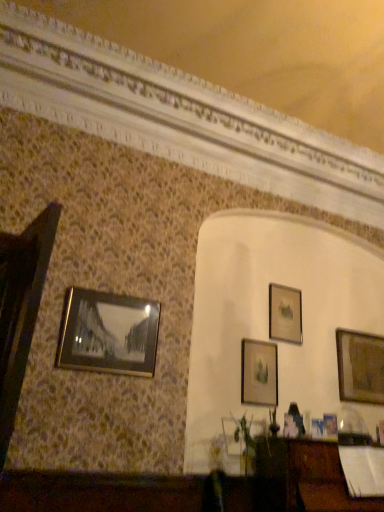
Question: From a real-world perspective, is matte gold picture frame at center, the third picture frame from the back, located beneath matte gold picture frame at upper right, which is the 4th picture frame from front to back?

Choices:
 (A) yes
 (B) no

Answer: (A)

Question: Is matte gold picture frame at center, arranged as the 3th picture frame when viewed from the front, facing away from matte gold picture frame at upper right, which is the 2th picture frame in back-to-front order?

Choices:
 (A) no
 (B) yes

Answer: (A)

Question: Can matte gold picture frame at upper right, which ranks as the third picture frame in left-to-right order, be found inside matte gold picture frame at center, the third picture frame from the back?

Choices:
 (A) no
 (B) yes

Answer: (A)

Question: Is matte gold picture frame at center, the third picture frame from the back, thinner than matte gold picture frame at upper right, which is the 2th picture frame in back-to-front order?

Choices:
 (A) yes
 (B) no

Answer: (B)

Question: Does matte gold picture frame at center, arranged as the 3th picture frame when viewed from the front, come in front of matte gold picture frame at upper right, the third picture frame in the right-to-left sequence?

Choices:
 (A) yes
 (B) no

Answer: (A)

Question: From the image's perspective, is matte gold picture frame at center, the 4th picture frame from the right, below matte gold picture frame at upper right, which is the 4th picture frame from front to back?

Choices:
 (A) yes
 (B) no

Answer: (A)

Question: Considering the relative positions of wooden picture frame at right, the 1th picture frame in the back-to-front sequence, and metallic gold picture frame at left, which is counted as the first picture frame, starting from the left, in the image provided, is wooden picture frame at right, the 1th picture frame in the back-to-front sequence, to the left of metallic gold picture frame at left, which is counted as the first picture frame, starting from the left, from the viewer's perspective?

Choices:
 (A) yes
 (B) no

Answer: (B)

Question: Does wooden picture frame at right, the 1th picture frame in the back-to-front sequence, come behind metallic gold picture frame at left, which is counted as the first picture frame, starting from the left?

Choices:
 (A) yes
 (B) no

Answer: (A)

Question: Is wooden picture frame at right, the fifth picture frame in the front-to-back sequence, bigger than metallic gold picture frame at left, which ranks as the 5th picture frame in back-to-front order?

Choices:
 (A) yes
 (B) no

Answer: (A)

Question: From a real-world perspective, is wooden picture frame at right, the fifth picture frame in the front-to-back sequence, located higher than metallic gold picture frame at left, which ranks as the 5th picture frame in back-to-front order?

Choices:
 (A) no
 (B) yes

Answer: (B)

Question: Is metallic gold picture frame at left, the 1th picture frame when ordered from front to back, located within wooden picture frame at right, the fifth picture frame in the front-to-back sequence?

Choices:
 (A) yes
 (B) no

Answer: (B)

Question: Is wooden picture frame at right, marked as the fifth picture frame in a left-to-right arrangement, wider than metallic gold picture frame at left, which ranks as the 5th picture frame in back-to-front order?

Choices:
 (A) yes
 (B) no

Answer: (A)

Question: From a real-world perspective, is matte gold picture frame at upper right, which ranks as the third picture frame in left-to-right order, on metallic gold picture frame at lower right, the fourth picture frame when ordered from back to front?

Choices:
 (A) yes
 (B) no

Answer: (A)